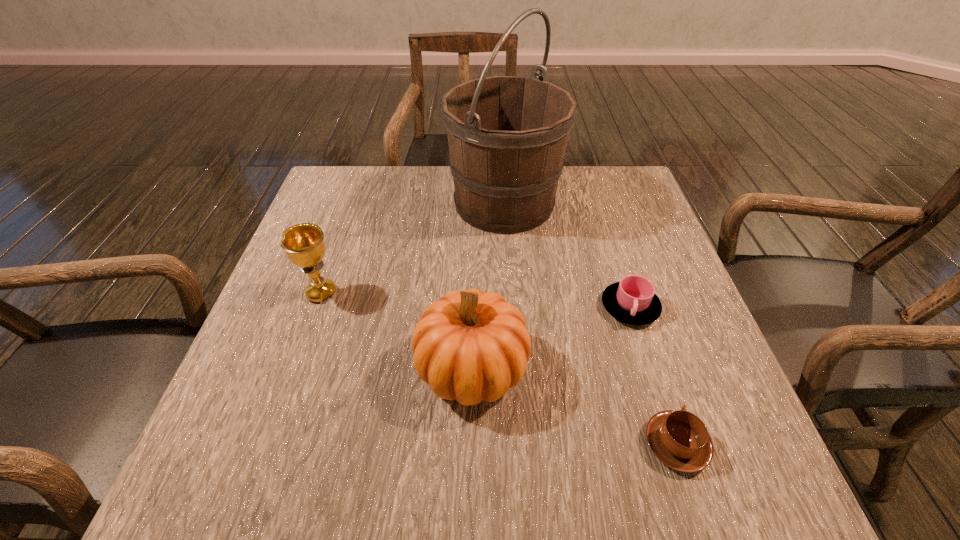
I want to click on vacant space at the far edge of the desktop, so click(401, 209).

Locate an element on the screen. This screenshot has height=540, width=960. vacant point at the left edge is located at coordinates (269, 319).

You are a GUI agent. You are given a task and a screenshot of the screen. Output one action in this format:
    pyautogui.click(x=<x>, y=<y>)
    Task: Click on the vacant space at the right edge of the desktop
    
    Given the screenshot: What is the action you would take?
    pyautogui.click(x=636, y=333)

This screenshot has height=540, width=960. In order to click on free space at the near left corner of the desktop in this screenshot , I will do `click(251, 469)`.

The height and width of the screenshot is (540, 960). Find the location of `vacant space at the far right corner of the desktop`. vacant space at the far right corner of the desktop is located at coordinates pos(636,184).

Where is `free space at the near right corner of the desktop`? free space at the near right corner of the desktop is located at coordinates (679, 477).

The image size is (960, 540). Identify the location of unoccupied position between the pumpkin and the cappuccino. (574, 406).

You are a GUI agent. You are given a task and a screenshot of the screen. Output one action in this format:
    pyautogui.click(x=<x>, y=<y>)
    Task: Click on the vacant area between the bucket and the cappuccino
    This screenshot has height=540, width=960.
    Given the screenshot: What is the action you would take?
    pyautogui.click(x=590, y=323)

Identify the location of free space that is in between the farthest object and the cup. (567, 255).

Locate an element on the screen. The width and height of the screenshot is (960, 540). empty space that is in between the third shortest object and the bucket is located at coordinates (413, 248).